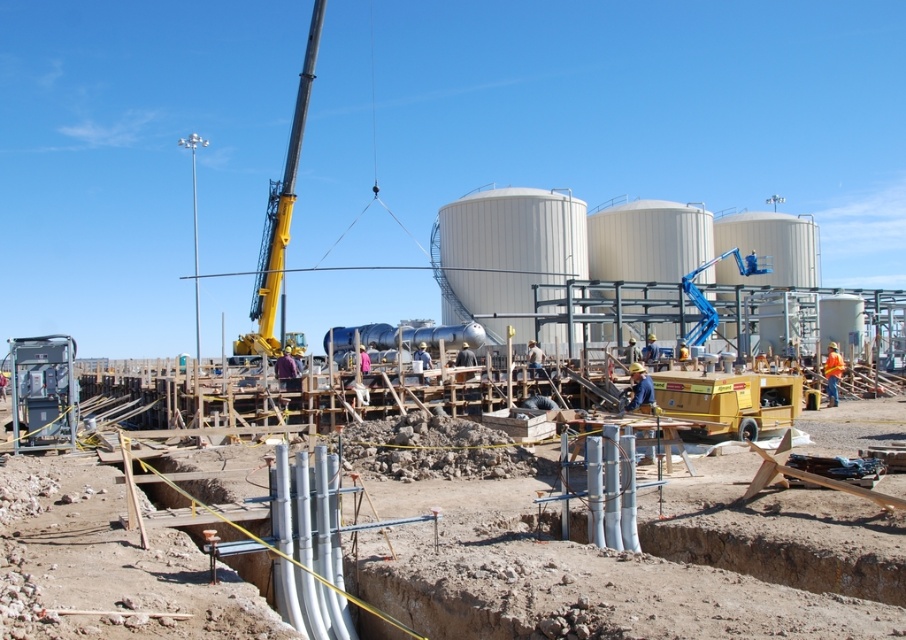
Question: Is white concrete pipes at center thinner than metallic gray generator at lower left?

Choices:
 (A) no
 (B) yes

Answer: (A)

Question: Where is white concrete pipes at center located in relation to yellow metallic crane at upper left in the image?

Choices:
 (A) below
 (B) above

Answer: (A)

Question: Which point is closer to the camera?

Choices:
 (A) white concrete pipes at center
 (B) metallic gray generator at lower left
 (C) yellow metallic crane at upper left

Answer: (A)

Question: Among these points, which one is farthest from the camera?

Choices:
 (A) (262, 284)
 (B) (61, 348)
 (C) (743, 604)

Answer: (A)

Question: Can you confirm if yellow metallic crane at upper left is positioned above metallic gray generator at lower left?

Choices:
 (A) yes
 (B) no

Answer: (A)

Question: Among these objects, which one is nearest to the camera?

Choices:
 (A) white concrete pipes at center
 (B) yellow metallic crane at upper left
 (C) metallic gray generator at lower left

Answer: (A)